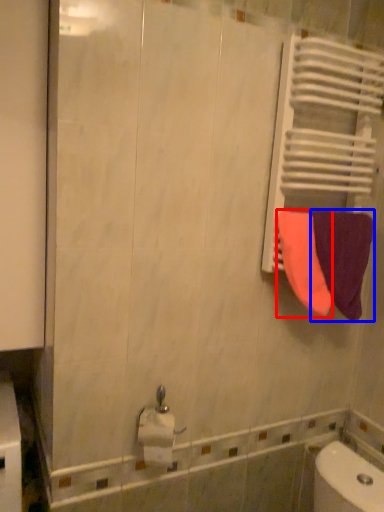
Question: Which object is further to the camera taking this photo, towel (highlighted by a red box) or towel (highlighted by a blue box)?

Choices:
 (A) towel
 (B) towel

Answer: (B)